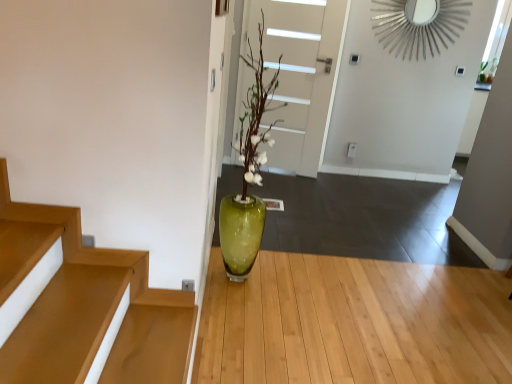
Question: Is green glass vase at center in contact with green glass vase at center?

Choices:
 (A) yes
 (B) no

Answer: (B)

Question: Does green glass vase at center come in front of green glass vase at center?

Choices:
 (A) yes
 (B) no

Answer: (B)

Question: Is green glass vase at center oriented away from green glass vase at center?

Choices:
 (A) yes
 (B) no

Answer: (B)

Question: Is green glass vase at center to the right of green glass vase at center from the viewer's perspective?

Choices:
 (A) no
 (B) yes

Answer: (A)

Question: Is green glass vase at center outside of green glass vase at center?

Choices:
 (A) no
 (B) yes

Answer: (B)

Question: Can you confirm if green glass vase at center is taller than green glass vase at center?

Choices:
 (A) yes
 (B) no

Answer: (A)

Question: Considering the relative sizes of white matte door at center and green glass vase at center in the image provided, is white matte door at center taller than green glass vase at center?

Choices:
 (A) yes
 (B) no

Answer: (A)

Question: Can you confirm if white matte door at center is wider than green glass vase at center?

Choices:
 (A) no
 (B) yes

Answer: (A)

Question: Is white matte door at center positioned far away from green glass vase at center?

Choices:
 (A) yes
 (B) no

Answer: (A)

Question: From the image's perspective, does white matte door at center appear higher than green glass vase at center?

Choices:
 (A) no
 (B) yes

Answer: (B)

Question: Considering the relative sizes of white matte door at center and green glass vase at center in the image provided, is white matte door at center smaller than green glass vase at center?

Choices:
 (A) no
 (B) yes

Answer: (B)

Question: Is white matte door at center not inside green glass vase at center?

Choices:
 (A) yes
 (B) no

Answer: (A)

Question: Considering the relative positions of green glass vase at center and white matte door at center in the image provided, is green glass vase at center to the left of white matte door at center from the viewer's perspective?

Choices:
 (A) yes
 (B) no

Answer: (B)